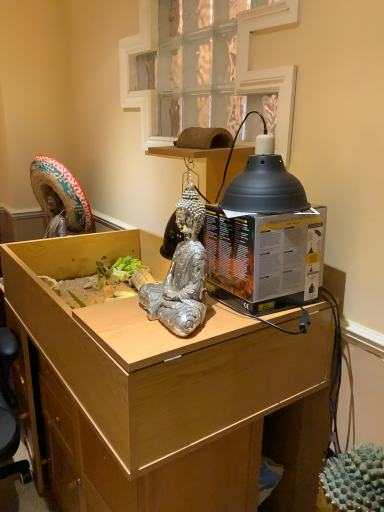
Question: In terms of size, does light wood desk at center appear bigger or smaller than silver metallic statue at center?

Choices:
 (A) big
 (B) small

Answer: (A)

Question: Considering the positions of point (223, 351) and point (203, 258), is point (223, 351) closer or farther from the camera than point (203, 258)?

Choices:
 (A) closer
 (B) farther

Answer: (B)

Question: Estimate the real-world distances between objects in this image. Which object is farther from the silver metallic statue at center?

Choices:
 (A) black cardboard box at right
 (B) clear glass window at upper center
 (C) light wood desk at center
 (D) black matte lampshade at upper right

Answer: (B)

Question: Considering the real-world distances, which object is closest to the silver metallic statue at center?

Choices:
 (A) black matte lampshade at upper right
 (B) black cardboard box at right
 (C) clear glass window at upper center
 (D) light wood desk at center

Answer: (B)